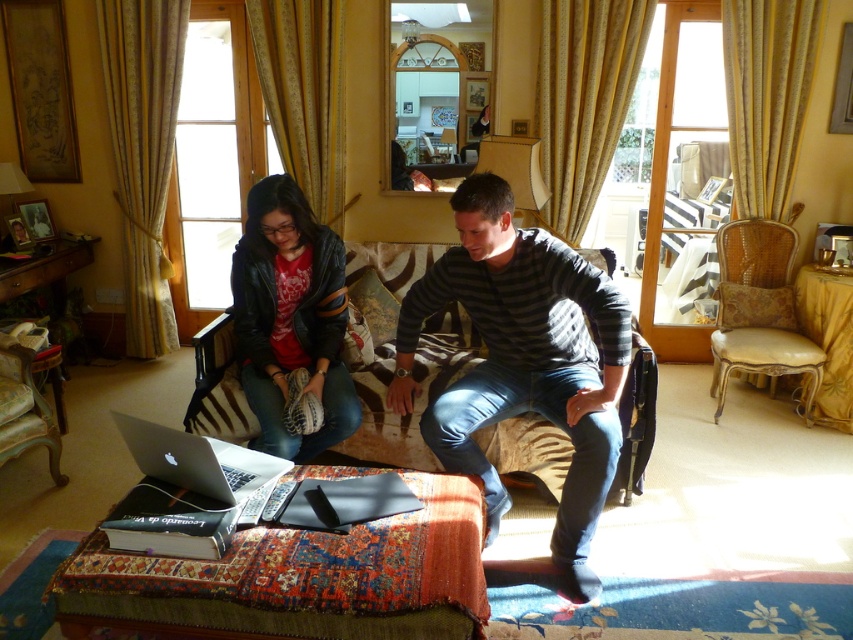
Is zebra-patterned fabric couch at center to the left of leather jacket at center from the viewer's perspective?

No, zebra-patterned fabric couch at center is not to the left of leather jacket at center.

Does zebra-patterned fabric couch at center appear over leather jacket at center?

No.

Who is more forward, (384, 355) or (299, 198)?

Point (299, 198) is in front.

I want to click on zebra-patterned fabric couch at center, so click(x=392, y=349).

Who is shorter, leather jacket at center or light brown leather armchair at right?

Standing shorter between the two is leather jacket at center.

Which is behind, point (297, 346) or point (785, 246)?

The point (785, 246) is more distant.

Identify the location of leather jacket at center. (291, 317).

Which is in front, point (715, 355) or point (172, 452)?

Point (172, 452) is in front.

Between light brown leather armchair at right and silver metallic laptop at center, which one has less height?

Standing shorter between the two is silver metallic laptop at center.

Between point (709, 388) and point (198, 465), which one is positioned in front?

Point (198, 465) is in front.

Locate an element on the screen. light brown leather armchair at right is located at coordinates (759, 308).